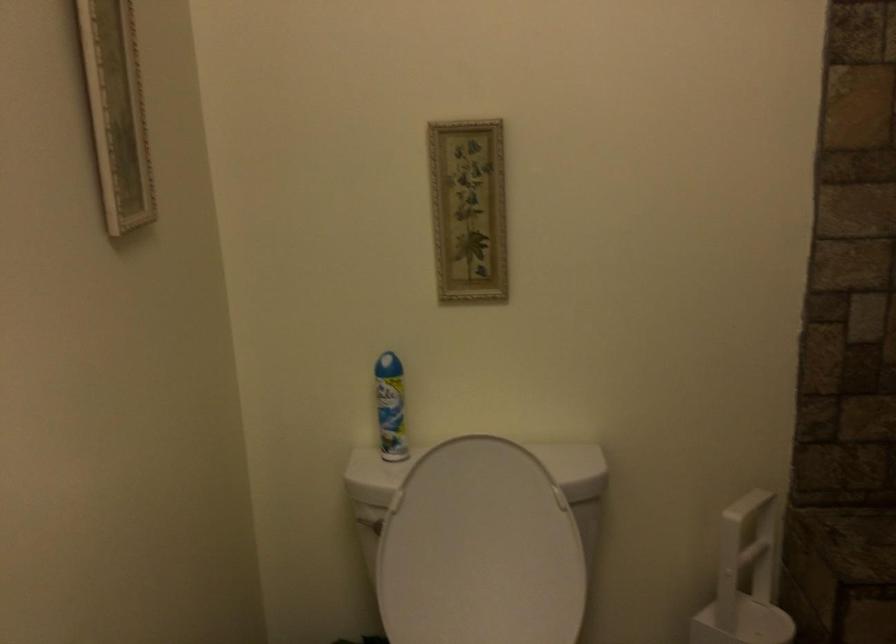
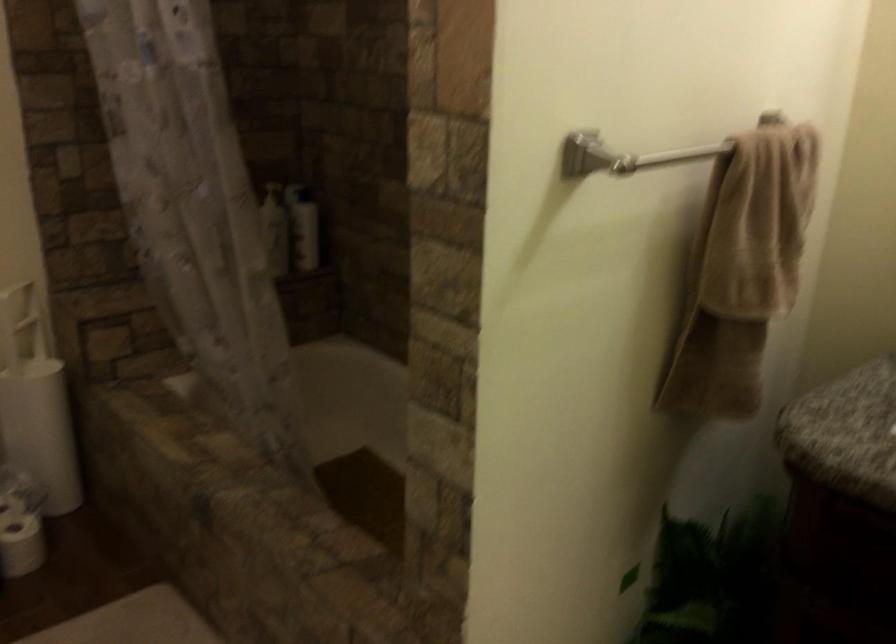
The point at (736, 559) is marked in the first image. Where is the corresponding point in the second image?

(20, 323)